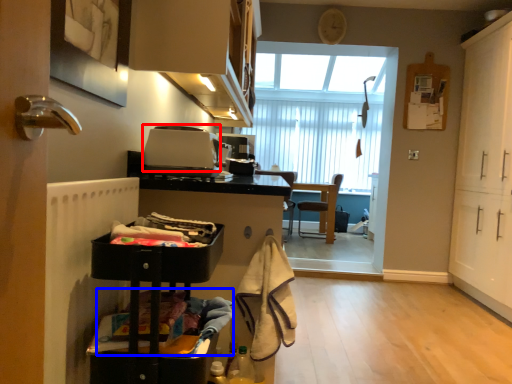
Question: Which object is closer to the camera taking this photo, appliance (highlighted by a red box) or laundry (highlighted by a blue box)?

Choices:
 (A) appliance
 (B) laundry

Answer: (B)